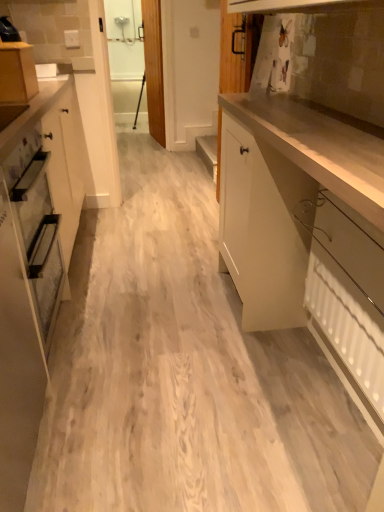
What are the coordinates of `vacant space to the right of white glossy cabinet at left, the 2th cabinetry when ordered from left to right` in the screenshot? It's located at (139, 450).